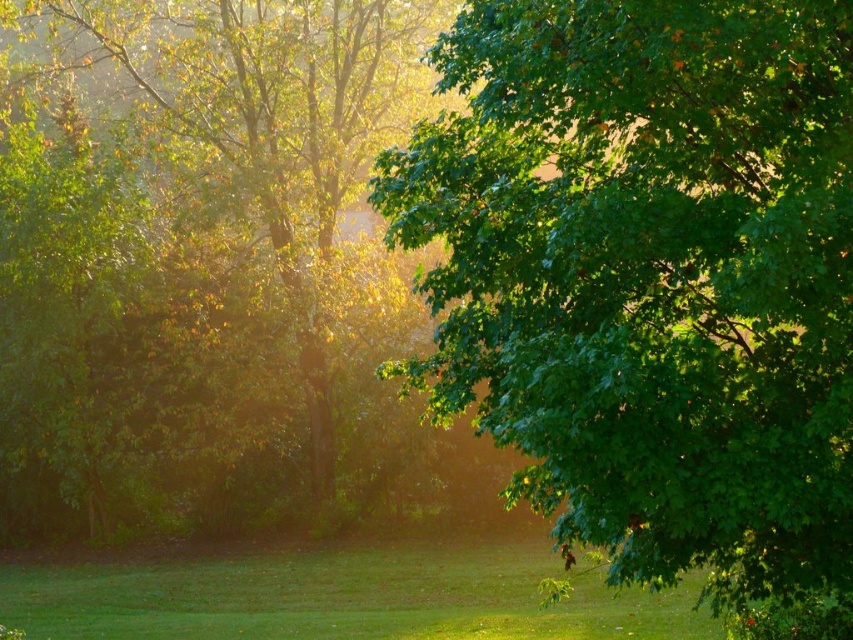
Who is positioned more to the left, green leafy tree at left or green grass at lower center?

green leafy tree at left is more to the left.

Is green leafy tree at left thinner than green grass at lower center?

Incorrect, green leafy tree at left's width is not less than green grass at lower center's.

Between point (251, 371) and point (119, 593), which one is positioned behind?

The point (251, 371) is behind.

Locate an element on the screen. The height and width of the screenshot is (640, 853). green leafy tree at left is located at coordinates (x=201, y=262).

Identify the location of green leafy tree at upper right. [653, 284].

Which of these two, green leafy tree at upper right or green grass at lower center, stands shorter?

green leafy tree at upper right

The image size is (853, 640). What are the coordinates of `green leafy tree at upper right` in the screenshot? It's located at (653, 284).

Is green leafy tree at upper right to the right of green leafy tree at left from the viewer's perspective?

Indeed, green leafy tree at upper right is positioned on the right side of green leafy tree at left.

This screenshot has width=853, height=640. What do you see at coordinates (653, 284) in the screenshot?
I see `green leafy tree at upper right` at bounding box center [653, 284].

Is point (825, 102) positioned before point (178, 284)?

Yes.

Identify the location of green leafy tree at upper right. This screenshot has width=853, height=640. (653, 284).